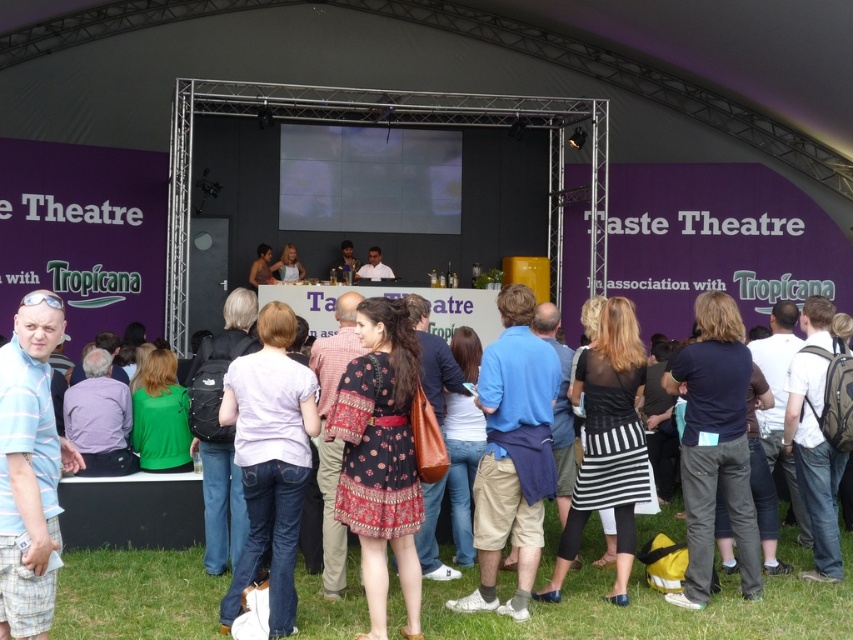
Question: Can you confirm if blue striped polo shirt at left is positioned below light brown hair at center?

Choices:
 (A) no
 (B) yes

Answer: (B)

Question: Estimate the real-world distances between objects in this image. Which object is farther from the blue striped polo shirt at left?

Choices:
 (A) light brown hair at center
 (B) matte black shirt at center
 (C) white shirt at center

Answer: (C)

Question: Based on their relative distances, which object is nearer to the metallic silver microphone at center?

Choices:
 (A) light brown hair at center
 (B) white shirt at center
 (C) matte black shirt at center

Answer: (B)

Question: Considering the real-world distances, which object is farthest from the matte black shirt at center?

Choices:
 (A) metallic silver microphone at center
 (B) white shirt at center
 (C) light brown hair at center
 (D) blue striped polo shirt at left

Answer: (D)

Question: Is blue striped polo shirt at left further to the viewer compared to white shirt at center?

Choices:
 (A) no
 (B) yes

Answer: (A)

Question: Does light brown hair at center have a greater width compared to metallic silver microphone at center?

Choices:
 (A) no
 (B) yes

Answer: (B)